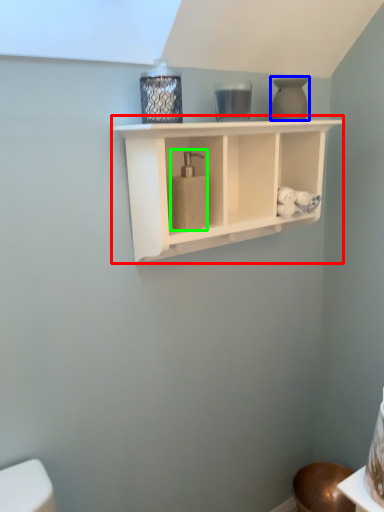
Question: Based on their relative distances, which object is farther from shelf (highlighted by a red box)? Choose from vase (highlighted by a blue box) and soap dispenser (highlighted by a green box).

Choices:
 (A) vase
 (B) soap dispenser

Answer: (A)